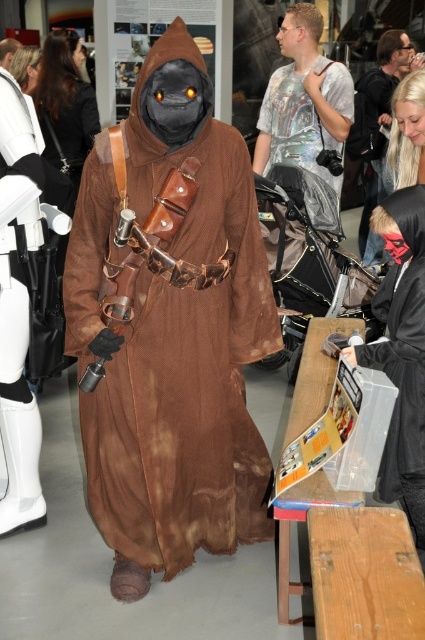
You are an attendee at the convention and want to take a photo of both the brown fabric costume at center and the smooth black mask at upper right. If your camera has a maximum focus range of 10 feet, will you be able to capture both objects clearly in the same photo?

The brown fabric costume at center is 10.65 feet away from the smooth black mask at upper right. Since the camera can only focus up to 10 feet, the distance between them exceeds the maximum range. Therefore, you cannot capture both clearly in the same photo.

You are standing in the convention hall and see two points marked in the image. Which point is nearer to you, point 1 at coordinates (x=167, y=406) or point 2 at coordinates (x=351, y=150)?

Point 1 at coordinates (x=167, y=406) is closer to the viewer than point 2 at coordinates (x=351, y=150).